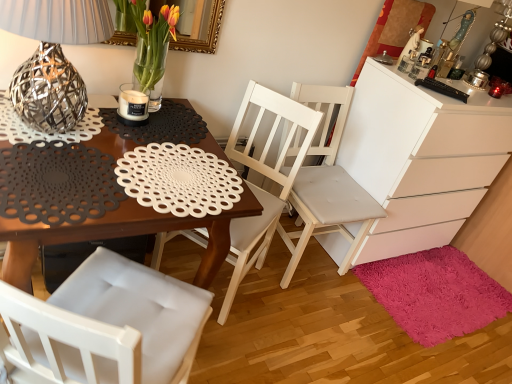
Identify the location of vacant space in between metallic wire ball at left and white matte candle at table. (124, 127).